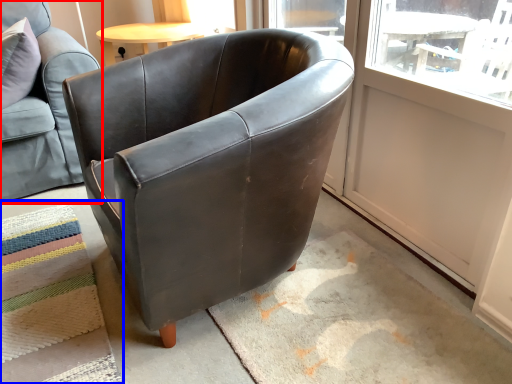
Question: Which of the following is the farthest to the observer, chair (highlighted by a red box) or mat (highlighted by a blue box)?

Choices:
 (A) chair
 (B) mat

Answer: (A)